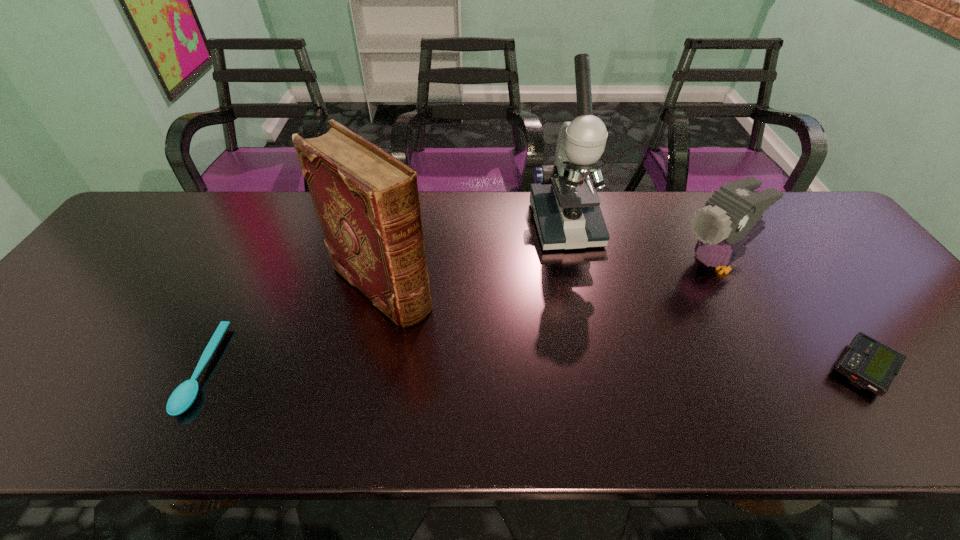
In the image, there is a desktop. At what (x,y) coordinates should I click in order to perform the action: click on blank space at the far left corner. Please return your answer as a coordinate pair (x, y). Image resolution: width=960 pixels, height=540 pixels. Looking at the image, I should click on (154, 231).

This screenshot has height=540, width=960. In the image, there is a desktop. Identify the location of free space at the far right corner. (788, 211).

This screenshot has width=960, height=540. What are the coordinates of `vacant space that's between the shortest object and the beeper` in the screenshot? It's located at (533, 369).

Locate an element on the screen. This screenshot has height=540, width=960. vacant area that lies between the fourth tallest object and the shortest object is located at coordinates (533, 369).

Locate an element on the screen. This screenshot has height=540, width=960. free area in between the fourth object from left to right and the third object from left to right is located at coordinates (639, 244).

The image size is (960, 540). Identify the location of unoccupied area between the third shortest object and the third object from left to right. (639, 244).

This screenshot has width=960, height=540. I want to click on vacant region between the leftmost object and the second shortest object, so click(x=533, y=369).

I want to click on vacant space that's between the bird and the microscope, so click(x=639, y=244).

Where is `empty location between the fourth shortest object and the third tallest object`? The image size is (960, 540). empty location between the fourth shortest object and the third tallest object is located at coordinates (547, 275).

Find the location of a particular element. This screenshot has height=540, width=960. free spot between the third shortest object and the rightmost object is located at coordinates (788, 316).